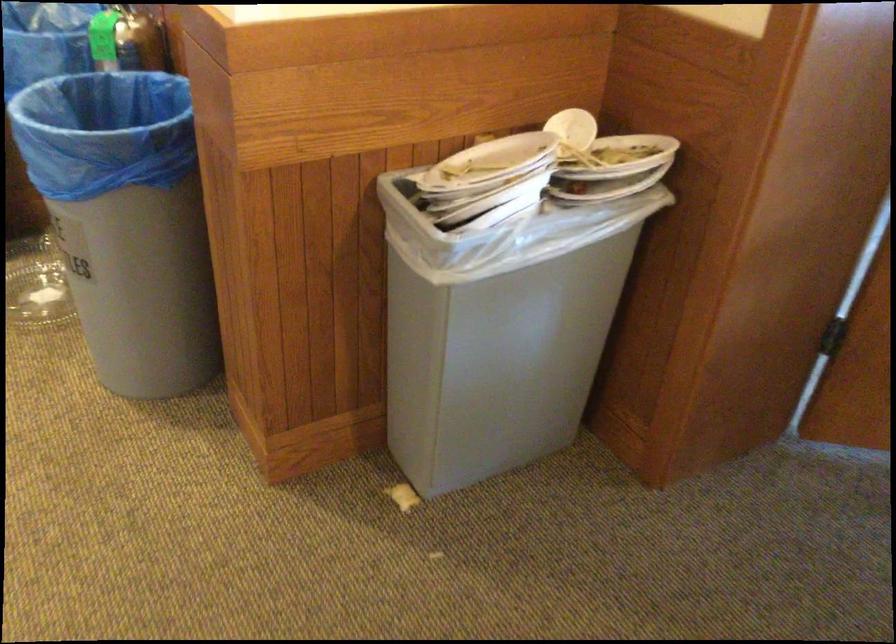
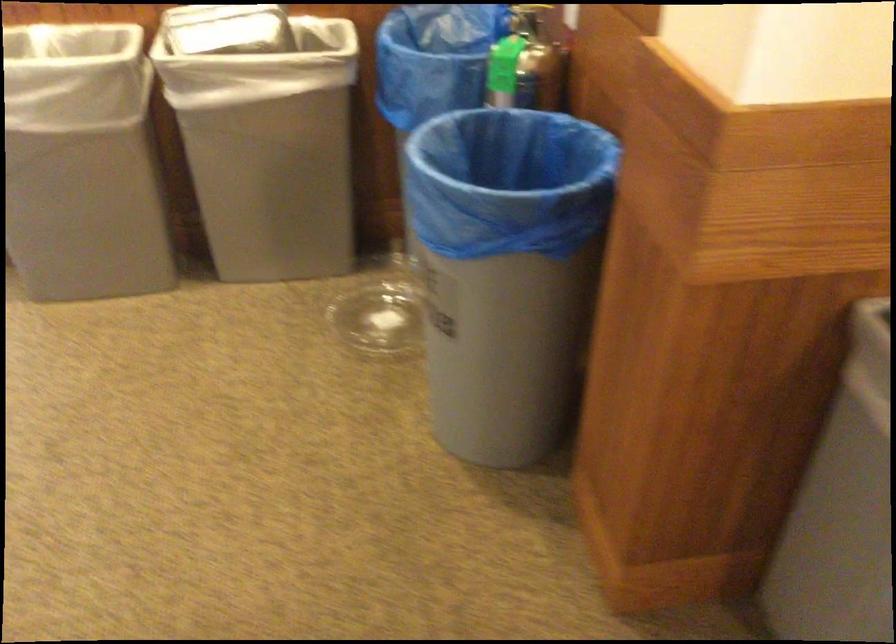
Question: Based on the continuous images, in which direction is the camera rotating? Reply with the corresponding letter.

Choices:
 (A) Left
 (B) Right
 (C) Up
 (D) Down

Answer: (A)